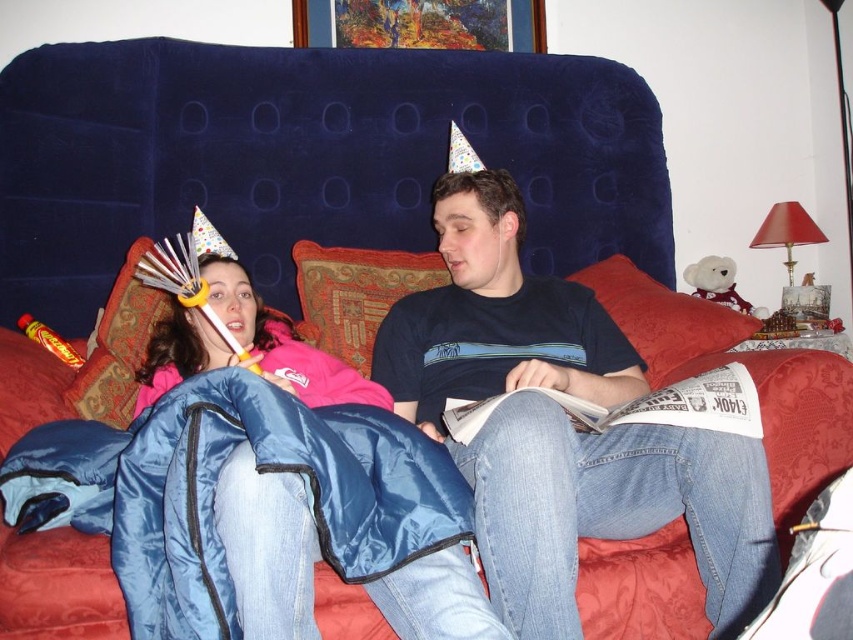
In the scene shown: You are organizing a sleepover and need to arrange two sleeping bags. The blue quilted sleeping bag at left and the blue synthetic sleeping bag at lower left are in the way of the door. Which sleeping bag should you move first to clear the path to the door?

You should move the blue synthetic sleeping bag at lower left first because it is positioned to the left of the blue quilted sleeping bag at left, making it closer to the door.

You are organizing a sleepover and need to choose between the blue quilted sleeping bag at left and the blue synthetic sleeping bag at lower left. Which one can accommodate a taller guest more comfortably?

The blue quilted sleeping bag at left is larger in size than the blue synthetic sleeping bag at lower left, so it can accommodate a taller guest more comfortably.

You are a photographer trying to capture both the blue quilted sleeping bag at left and the blue synthetic sleeping bag at lower left in the same frame. Which sleeping bag should you adjust your camera focus to ensure it appears clearer in the photo?

The blue quilted sleeping bag at left is closer to the viewer, so adjusting the camera focus on it will make it clearer while the blue synthetic sleeping bag at lower left may appear slightly out of focus.